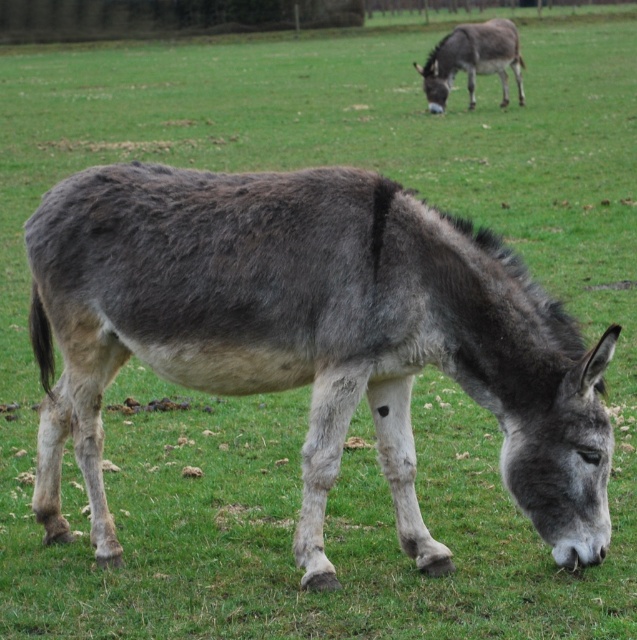
You are a farmer who wants to load hay onto both the gray fuzzy donkey at center and the gray matte mule at upper right. Given their sizes, which animal can carry more hay?

The gray fuzzy donkey at center has a larger size compared to gray matte mule at upper right, so it can carry more hay.

You are standing at the origin point of the coordinate system in the image. The gray fuzzy donkey at center is located at point (311, 337). If you want to walk directly to the gray fuzzy donkey at center, which direction should you move?

Since the gray fuzzy donkey at center is located at point (311, 337), you should move towards the center of the image to reach it.

You are standing in the field and see the gray fuzzy donkey at center and the gray matte mule at upper right. If you want to approach the one closer to you, which one should you walk towards?

The gray fuzzy donkey at center is closer to you than the gray matte mule at upper right, so you should walk towards the gray fuzzy donkey at center.